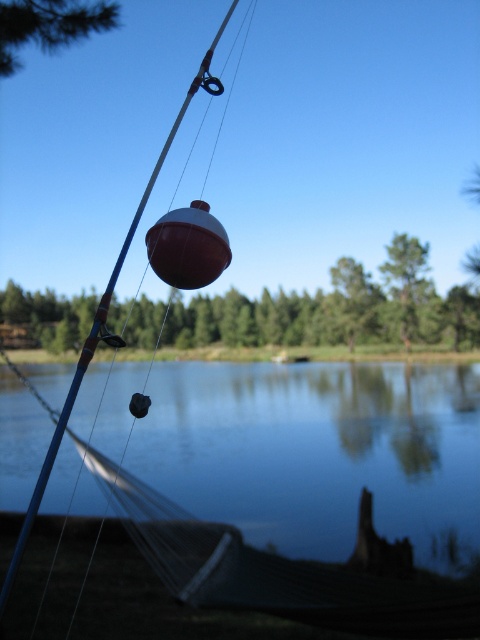
Question: Can you confirm if matte blue fishing pole at center is positioned to the right of green textured pine tree at upper left?

Choices:
 (A) no
 (B) yes

Answer: (B)

Question: Does smooth blue water at center appear under matte blue fishing pole at center?

Choices:
 (A) no
 (B) yes

Answer: (B)

Question: Is smooth blue water at center to the left of matte blue fishing pole at center from the viewer's perspective?

Choices:
 (A) yes
 (B) no

Answer: (B)

Question: Which is nearer to the smooth blue water at center?

Choices:
 (A) matte blue fishing pole at center
 (B) green matte tree at upper center
 (C) green textured pine tree at upper left

Answer: (B)

Question: Which object is closer to the camera taking this photo?

Choices:
 (A) matte blue fishing pole at center
 (B) smooth blue water at center
 (C) green textured pine tree at upper left

Answer: (A)

Question: Which object is positioned farthest from the matte blue fishing pole at center?

Choices:
 (A) smooth blue water at center
 (B) green matte tree at upper center

Answer: (B)